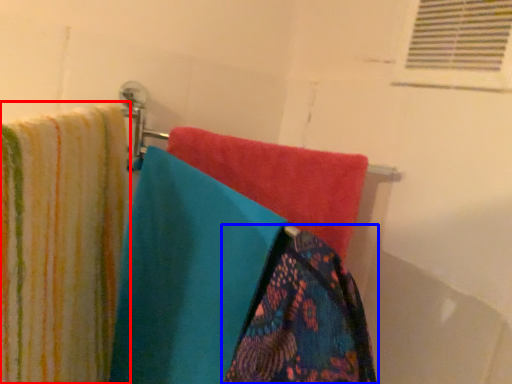
Question: Which object is closer to the camera taking this photo, towel (highlighted by a red box) or towel (highlighted by a blue box)?

Choices:
 (A) towel
 (B) towel

Answer: (A)